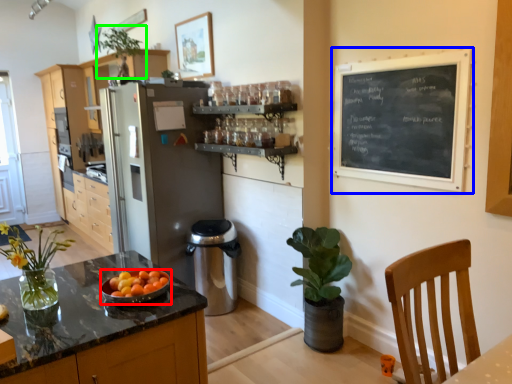
Question: Based on their relative distances, which object is nearer to kitchen appliance (highlighted by a red box)? Choose from bulletin board (highlighted by a blue box) and houseplant (highlighted by a green box).

Choices:
 (A) bulletin board
 (B) houseplant

Answer: (A)